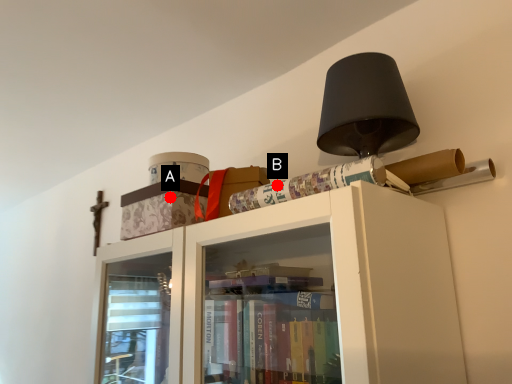
Question: Two points are circled on the image, labeled by A and B beside each circle. Among these points, which one is farthest from the camera?

Choices:
 (A) A is further
 (B) B is further

Answer: (A)